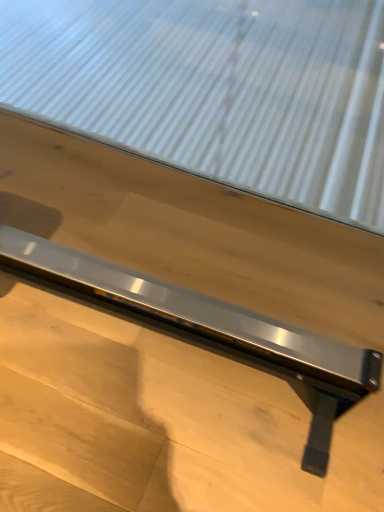
Locate an element on the screen. The width and height of the screenshot is (384, 512). satin metallic bench at center is located at coordinates (198, 262).

This screenshot has width=384, height=512. Describe the element at coordinates (198, 262) in the screenshot. I see `satin metallic bench at center` at that location.

Where is `satin metallic bench at center`? This screenshot has width=384, height=512. satin metallic bench at center is located at coordinates (198, 262).